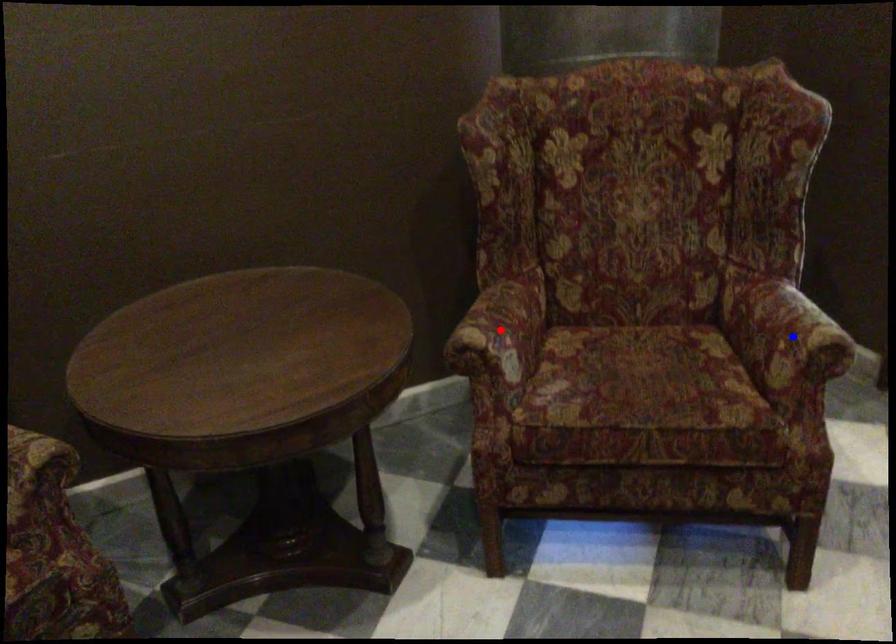
Question: Two points are marked on the image. Which point is closer to the camera?

Choices:
 (A) Blue point is closer.
 (B) Red point is closer.

Answer: (A)